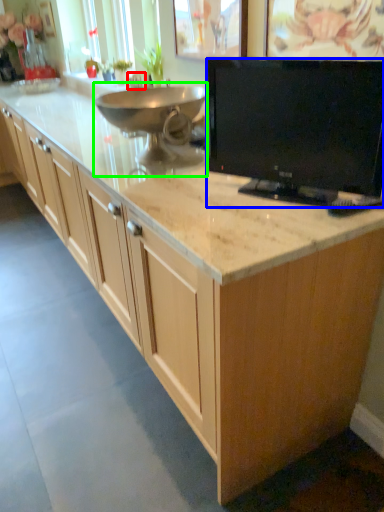
Question: Which object is the closest to the faucet (highlighted by a red box)? Choose among these: television (highlighted by a blue box) or appliance (highlighted by a green box).

Choices:
 (A) television
 (B) appliance

Answer: (B)